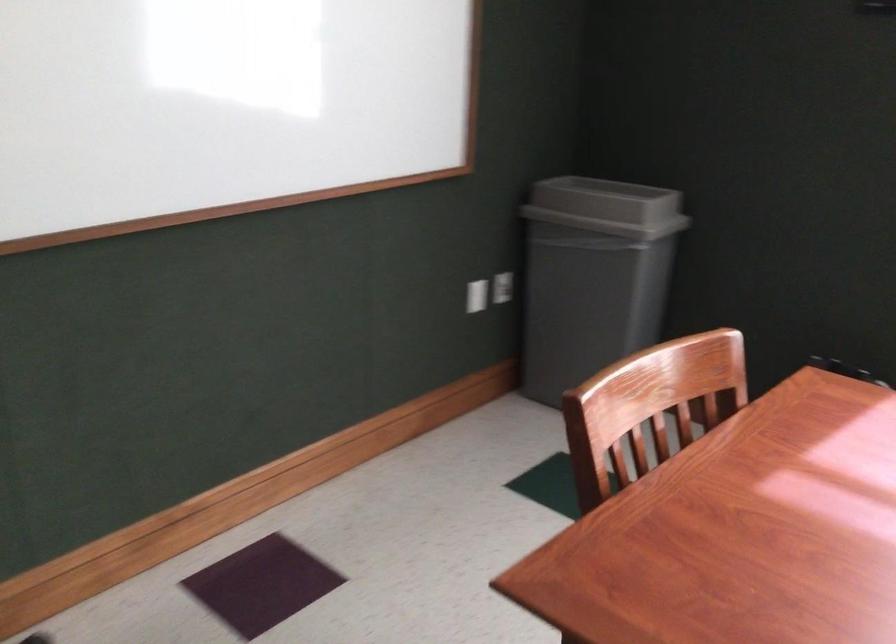
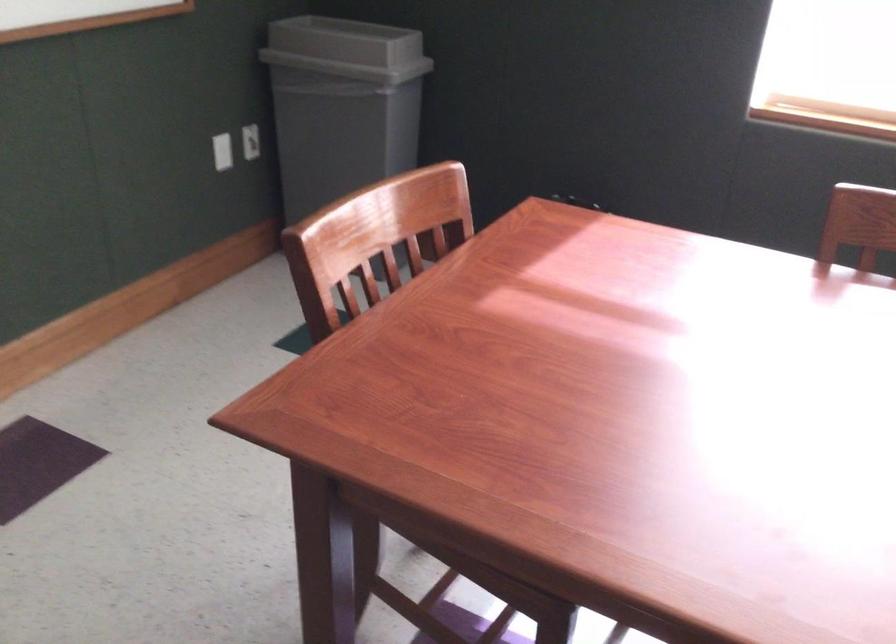
Locate, in the second image, the point that corresponds to [599,205] in the first image.

(346, 49)